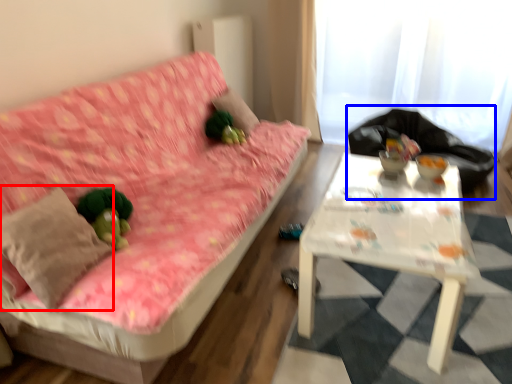
Question: Which of the following is the closest to the observer, throw pillow (highlighted by a red box) or sit (highlighted by a blue box)?

Choices:
 (A) throw pillow
 (B) sit

Answer: (A)